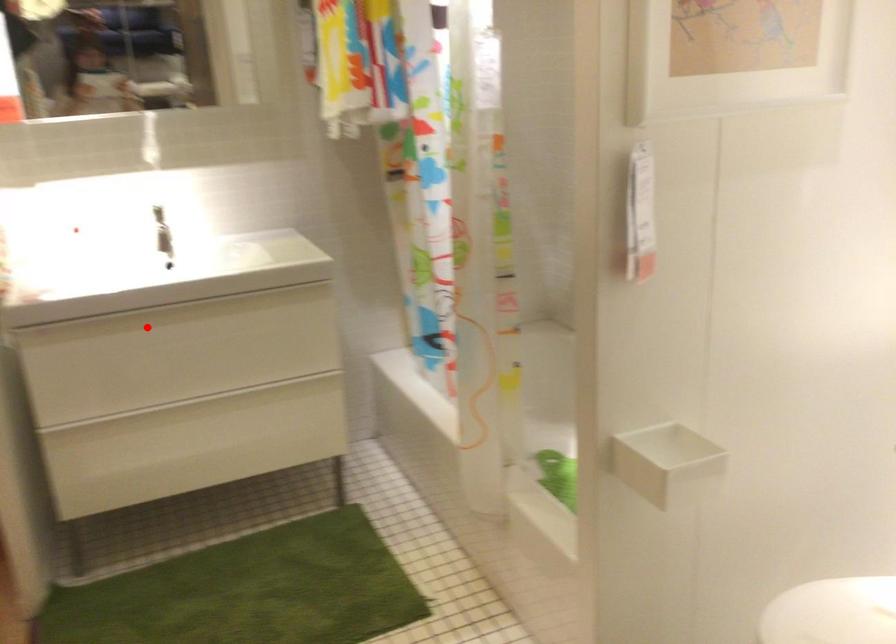
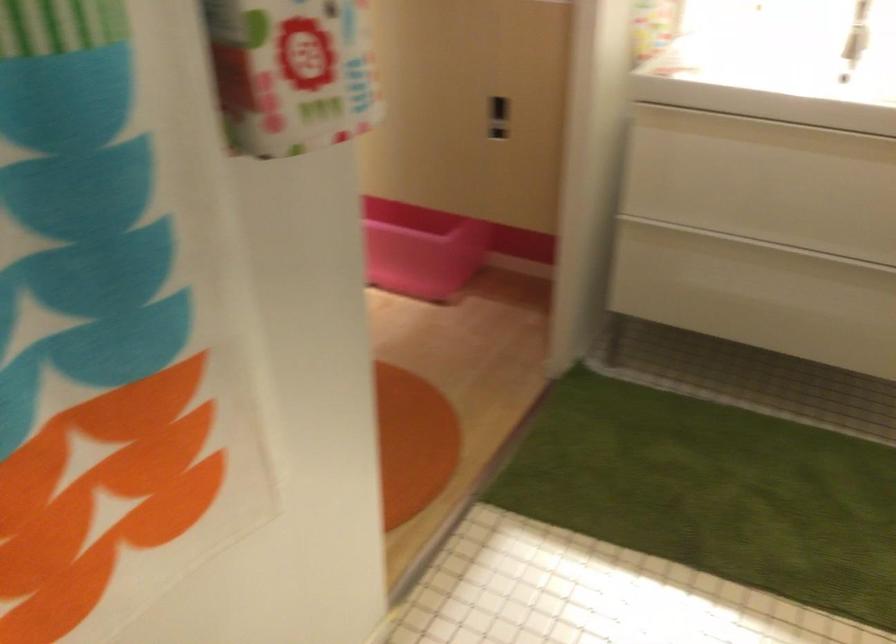
The point at the highlighted location is marked in the first image. Where is the corresponding point in the second image?

(764, 131)